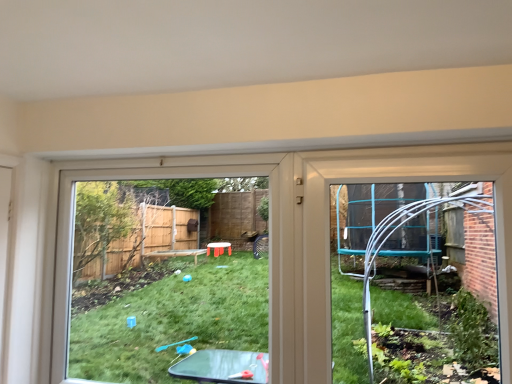
Locate an element on the screen. The height and width of the screenshot is (384, 512). clear plastic trampoline at right is located at coordinates (398, 182).

What do you see at coordinates (398, 182) in the screenshot? The width and height of the screenshot is (512, 384). I see `clear plastic trampoline at right` at bounding box center [398, 182].

What do you see at coordinates (151, 178) in the screenshot?
I see `transparent plastic table at center` at bounding box center [151, 178].

Identify the location of transparent plastic table at center. The width and height of the screenshot is (512, 384). (151, 178).

Image resolution: width=512 pixels, height=384 pixels. Identify the location of clear plastic trampoline at right. (398, 182).

Does clear plastic trampoline at right appear on the left side of transparent plastic table at center?

No.

Is clear plastic trampoline at right in front of transparent plastic table at center?

Yes.

Is point (310, 296) closer or farther from the camera than point (274, 287)?

Point (310, 296) is closer to the camera than point (274, 287).

From the picture: From the image's perspective, which is above, clear plastic trampoline at right or transparent plastic table at center?

clear plastic trampoline at right is shown above in the image.

From a real-world perspective, which is physically above, clear plastic trampoline at right or transparent plastic table at center?

From a 3D spatial view, clear plastic trampoline at right is above.

Between clear plastic trampoline at right and transparent plastic table at center, which one has larger width?

Wider between the two is transparent plastic table at center.

Does clear plastic trampoline at right have a greater height compared to transparent plastic table at center?

In fact, clear plastic trampoline at right may be shorter than transparent plastic table at center.

Can you confirm if clear plastic trampoline at right is smaller than transparent plastic table at center?

Yes, clear plastic trampoline at right is smaller than transparent plastic table at center.

Do you think clear plastic trampoline at right is within transparent plastic table at center, or outside of it?

clear plastic trampoline at right is not enclosed by transparent plastic table at center.

Is clear plastic trampoline at right not near transparent plastic table at center?

No, clear plastic trampoline at right is in close proximity to transparent plastic table at center.

Is clear plastic trampoline at right facing away from transparent plastic table at center?

clear plastic trampoline at right is not turned away from transparent plastic table at center.

How different are the orientations of clear plastic trampoline at right and transparent plastic table at center in degrees?

The angle between the facing direction of clear plastic trampoline at right and the facing direction of transparent plastic table at center is 0.0025 degrees.

How far apart are clear plastic trampoline at right and transparent plastic table at center?

The distance of clear plastic trampoline at right from transparent plastic table at center is 21.05 inches.

This screenshot has height=384, width=512. I want to click on bay window lying below the clear plastic trampoline at right (from the image's perspective), so [x=151, y=178].

In the image, is transparent plastic table at center on the left side or the right side of clear plastic trampoline at right?

In the image, transparent plastic table at center appears on the left side of clear plastic trampoline at right.

Is transparent plastic table at center in front of or behind clear plastic trampoline at right in the image?

In the image, transparent plastic table at center appears behind clear plastic trampoline at right.

Is point (273, 197) closer or farther from the camera than point (350, 163)?

Point (273, 197) is positioned farther from the camera compared to point (350, 163).

From the image's perspective, does transparent plastic table at center appear lower than clear plastic trampoline at right?

Yes, from the image's perspective, transparent plastic table at center is beneath clear plastic trampoline at right.

Based on the photo, from a real-world perspective, who is located higher, transparent plastic table at center or clear plastic trampoline at right?

clear plastic trampoline at right is physically above.

Is transparent plastic table at center wider than clear plastic trampoline at right?

Indeed, transparent plastic table at center has a greater width compared to clear plastic trampoline at right.

From their relative heights in the image, would you say transparent plastic table at center is taller or shorter than clear plastic trampoline at right?

In the image, transparent plastic table at center appears to be taller than clear plastic trampoline at right.

Does transparent plastic table at center have a larger size compared to clear plastic trampoline at right?

Yes.

Is transparent plastic table at center completely or partially outside of clear plastic trampoline at right?

Absolutely, transparent plastic table at center is external to clear plastic trampoline at right.

Is transparent plastic table at center with clear plastic trampoline at right?

No, transparent plastic table at center is not beside clear plastic trampoline at right.

Is transparent plastic table at center turned away from clear plastic trampoline at right?

No, clear plastic trampoline at right is not at the back of transparent plastic table at center.

Where is `bay window below the clear plastic trampoline at right (from a real-world perspective)`? The width and height of the screenshot is (512, 384). bay window below the clear plastic trampoline at right (from a real-world perspective) is located at coordinates (151, 178).

Where is `door located above the transparent plastic table at center (from a real-world perspective)`? door located above the transparent plastic table at center (from a real-world perspective) is located at coordinates (x=398, y=182).

At what (x,y) coordinates should I click in order to perform the action: click on door above the transparent plastic table at center (from the image's perspective). Please return your answer as a coordinate pair (x, y). Image resolution: width=512 pixels, height=384 pixels. Looking at the image, I should click on (398, 182).